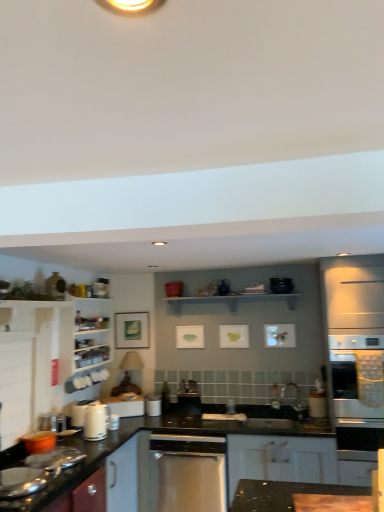
Question: In the image, is white glossy microwave at right, arranged as the first appliance when viewed from the front, on the left side or the right side of black glossy countertop at lower left, the second countertop viewed from the front?

Choices:
 (A) right
 (B) left

Answer: (A)

Question: Would you say white glossy microwave at right, which ranks as the first appliance in right-to-left order, is inside or outside black glossy countertop at lower left, the second countertop viewed from the front?

Choices:
 (A) outside
 (B) inside

Answer: (A)

Question: Estimate the real-world distances between objects in this image. Which object is farther from the white glossy cabinet at left, which is counted as the 2th cabinetry, starting from the right?

Choices:
 (A) brown wooden countertop at lower right, which is counted as the first countertop, starting from the right
 (B) satin stainless steel dishwasher at center
 (C) black glossy countertop at lower left, the 2th countertop viewed from the top
 (D) white matte cabinet at lower center, which ranks as the second cabinetry in left-to-right order
 (E) white glossy microwave at right, acting as the 2th appliance starting from the left

Answer: (E)

Question: Considering the real-world distances, which object is farthest from the black glossy countertop at lower left, which is the 1th countertop in back-to-front order?

Choices:
 (A) brown wooden countertop at lower right, which is counted as the first countertop, starting from the right
 (B) white glossy kettle at lower left
 (C) white matte cabinet at lower center, which ranks as the 1th cabinetry in bottom-to-top order
 (D) white glossy microwave at right, arranged as the first appliance when viewed from the front
 (E) white glossy cabinet at left, which is the 2th cabinetry from bottom to top

Answer: (D)